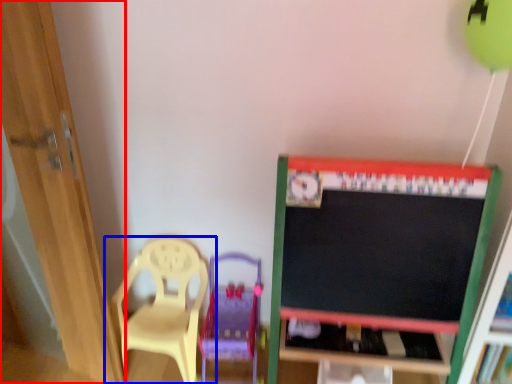
Question: Which object is closer to the camera taking this photo, door (highlighted by a red box) or chair (highlighted by a blue box)?

Choices:
 (A) door
 (B) chair

Answer: (A)